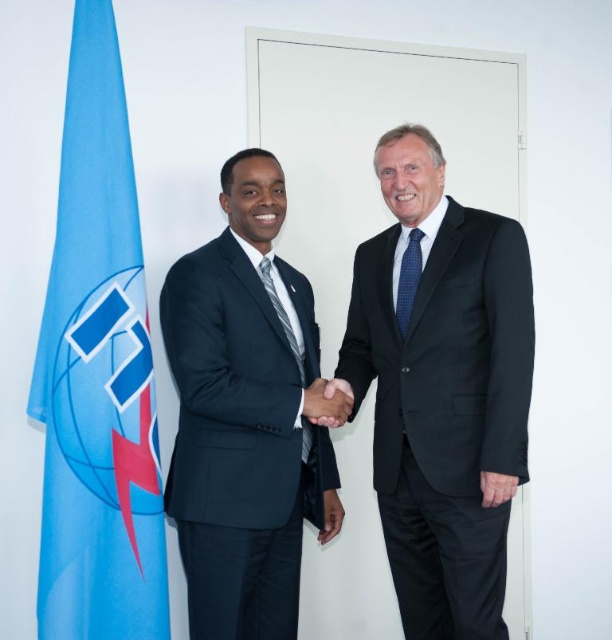
Question: Which is nearer to the striped fabric tie at center?

Choices:
 (A) blue fabric flag at left
 (B) blue dotted tie at center
 (C) black smooth suit at right

Answer: (B)

Question: Which object is the farthest from the black smooth suit at right?

Choices:
 (A) blue dotted tie at center
 (B) striped fabric tie at center
 (C) navy blue suit at center

Answer: (B)

Question: Is black smooth suit at right positioned at the back of blue dotted tie at center?

Choices:
 (A) yes
 (B) no

Answer: (B)

Question: Is blue fabric flag at left bigger than striped fabric tie at center?

Choices:
 (A) no
 (B) yes

Answer: (B)

Question: Which object is the farthest from the black smooth suit at right?

Choices:
 (A) striped fabric tie at center
 (B) blue dotted tie at center

Answer: (A)

Question: Can you confirm if black smooth hand at center is positioned below blue dotted tie at center?

Choices:
 (A) no
 (B) yes

Answer: (B)